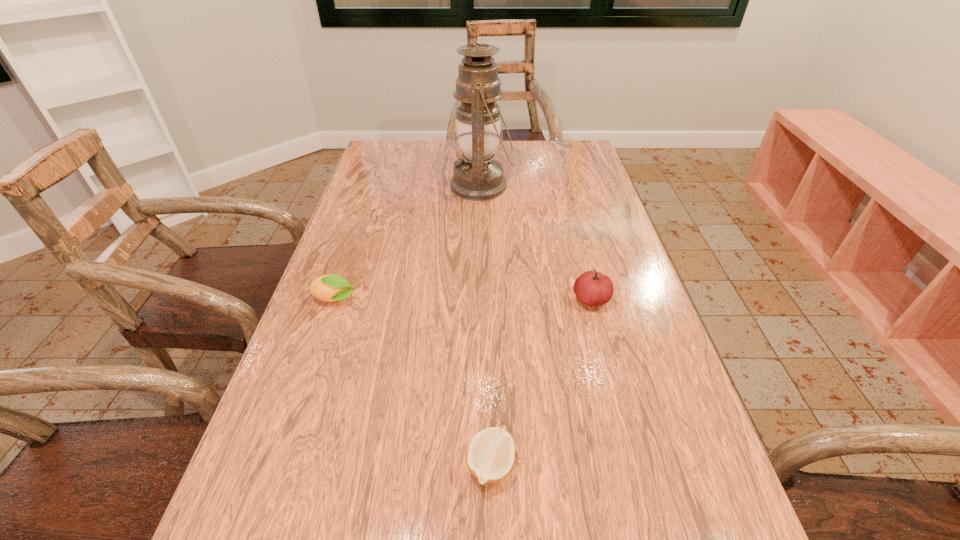
Locate an element on the screen. This screenshot has width=960, height=540. the farthest object is located at coordinates (478, 177).

Identify the location of the tallest object. The height and width of the screenshot is (540, 960). (478, 177).

This screenshot has height=540, width=960. What are the coordinates of `tomato` in the screenshot? It's located at (592, 288).

What are the coordinates of `the third shortest object` in the screenshot? It's located at (592, 288).

Image resolution: width=960 pixels, height=540 pixels. I want to click on the left lemon, so click(x=331, y=287).

Find the location of `the leftmost object`. the leftmost object is located at coordinates (331, 287).

Identify the location of the shortest object. (491, 453).

Find the location of a particular element. This screenshot has height=540, width=960. the nearer lemon is located at coordinates (491, 453).

Find the location of a particular element. vacant point located on the left of the farthest object is located at coordinates (418, 186).

What are the coordinates of `vacant space located 0.260m on the front of the rightmost object` in the screenshot? It's located at (623, 422).